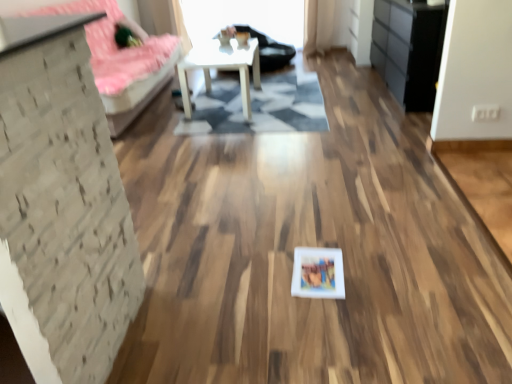
Locate an element on the screen. vacant space in matte white picture frame at center (from a real-world perspective) is located at coordinates (314, 275).